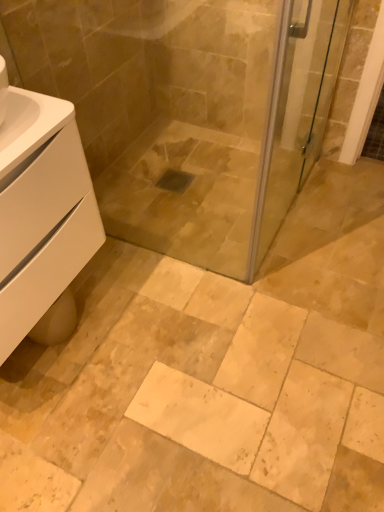
Locate an element on the screen. The image size is (384, 512). vacant space underneath transparent glass screen door at upper right (from a real-world perspective) is located at coordinates click(x=294, y=211).